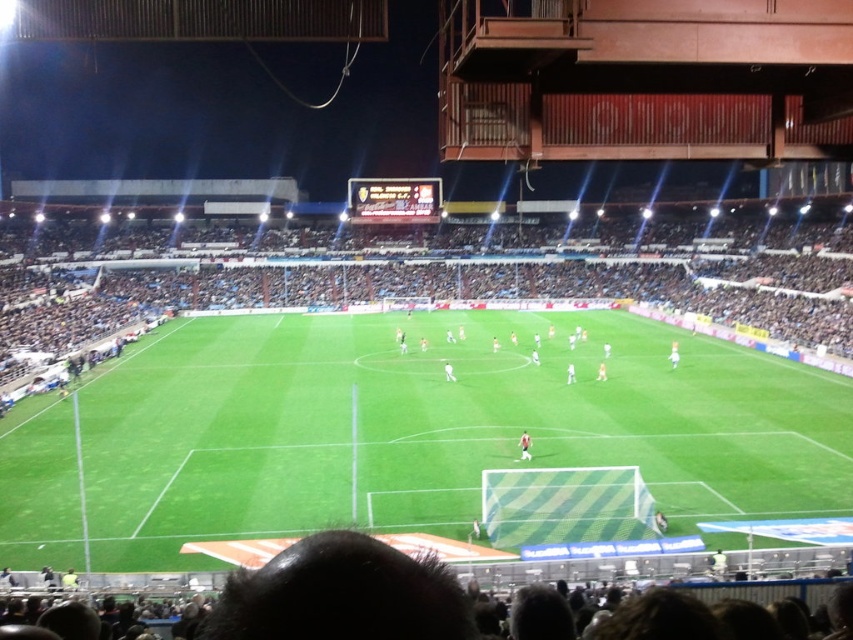
You are a drone operator trying to capture aerial footage of the soccer match. Your drone has a maximum flight range of 25 meters. If you are positioned at the stadium stands, can your drone reach the green grass football field at center without exceeding its range?

The distance between the green grass football field at center and the viewer is 22.60 meters. Since the drone has a maximum range of 25 meters, it can safely reach the field without exceeding its limit.